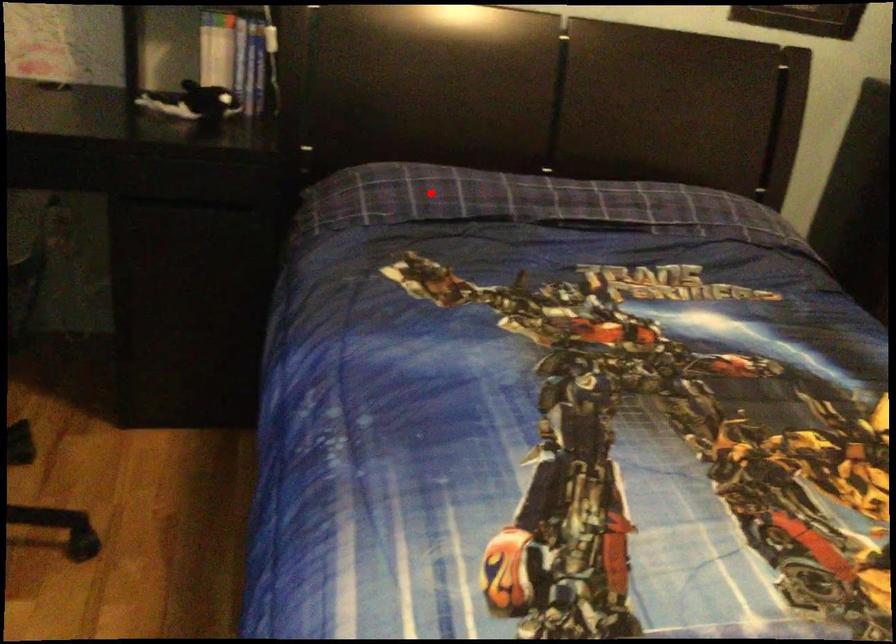
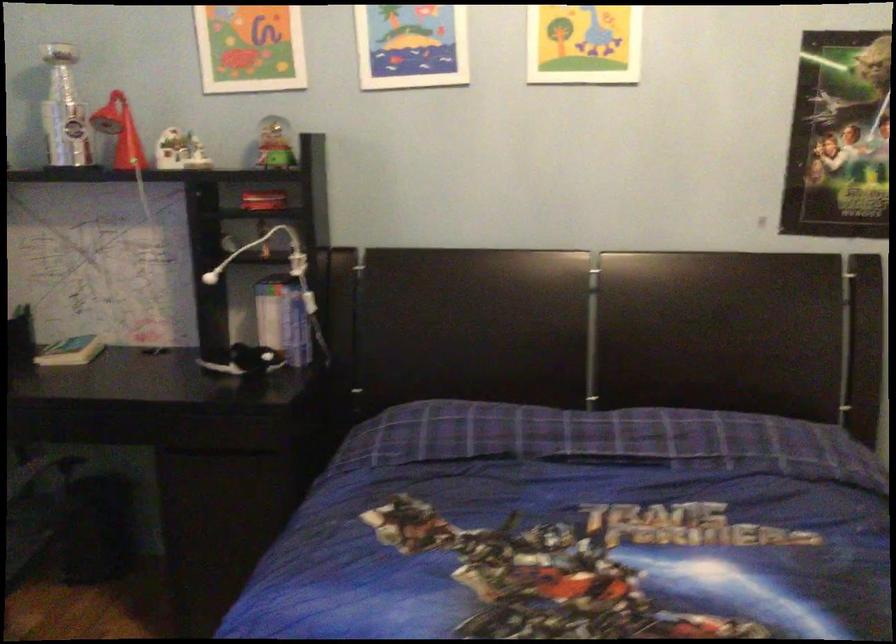
Find the pixel in the second image that matches the highlighted location in the first image.

(440, 431)